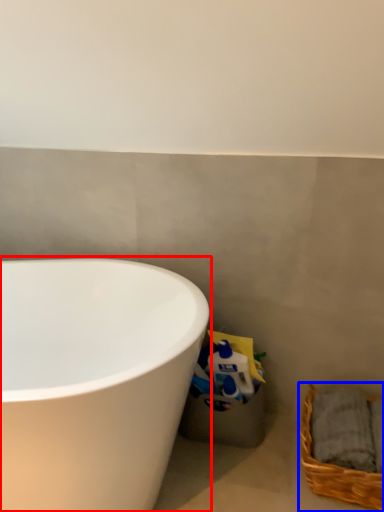
Question: Which point is closer to the camera, bathtub (highlighted by a red box) or picnic basket (highlighted by a blue box)?

Choices:
 (A) bathtub
 (B) picnic basket

Answer: (A)